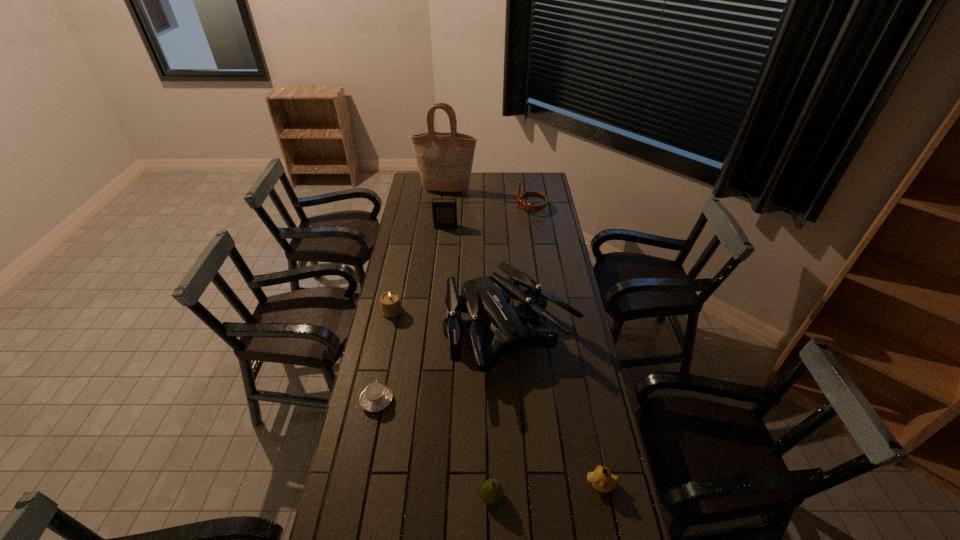
Identify the location of shopping bag. This screenshot has width=960, height=540. point(444,160).

This screenshot has height=540, width=960. Identify the location of the farthest object. (444, 160).

The image size is (960, 540). Identify the location of tiara. (529, 207).

Image resolution: width=960 pixels, height=540 pixels. What are the coordinates of `drone` in the screenshot? It's located at (488, 297).

I want to click on the sixth nearest object, so pyautogui.click(x=444, y=210).

Identify the location of the fifth tallest object. (391, 305).

Locate an element on the screen. The height and width of the screenshot is (540, 960). pear is located at coordinates (491, 492).

Find the location of a particular element. duckling is located at coordinates (603, 481).

At what (x,y) coordinates should I click in order to perform the action: click on the shortest object. Please return your answer as a coordinate pair (x, y). This screenshot has height=540, width=960. Looking at the image, I should click on (376, 396).

At what (x,y) coordinates should I click in order to perform the action: click on vacant region located on the front of the tallest object. Please return your answer as a coordinate pair (x, y). This screenshot has height=540, width=960. Looking at the image, I should click on (444, 214).